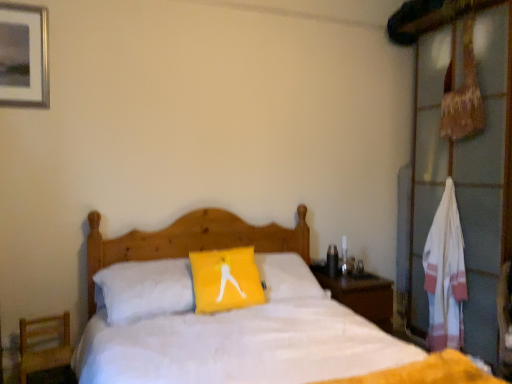
Question: From a real-world perspective, is metallic silver picture frame at upper left on white wood dresser at right?

Choices:
 (A) no
 (B) yes

Answer: (B)

Question: Is metallic silver picture frame at upper left surrounding white wood dresser at right?

Choices:
 (A) no
 (B) yes

Answer: (A)

Question: Is metallic silver picture frame at upper left to the left of white wood dresser at right from the viewer's perspective?

Choices:
 (A) yes
 (B) no

Answer: (A)

Question: Is metallic silver picture frame at upper left at the right side of white wood dresser at right?

Choices:
 (A) no
 (B) yes

Answer: (A)

Question: From the image's perspective, is metallic silver picture frame at upper left under white wood dresser at right?

Choices:
 (A) no
 (B) yes

Answer: (A)

Question: Considering the relative sizes of metallic silver picture frame at upper left and white wood dresser at right in the image provided, is metallic silver picture frame at upper left bigger than white wood dresser at right?

Choices:
 (A) no
 (B) yes

Answer: (A)

Question: Can you confirm if white striped towel at right is bigger than metallic silver picture frame at upper left?

Choices:
 (A) yes
 (B) no

Answer: (A)

Question: Is white striped towel at right located outside metallic silver picture frame at upper left?

Choices:
 (A) yes
 (B) no

Answer: (A)

Question: From a real-world perspective, is white striped towel at right located beneath metallic silver picture frame at upper left?

Choices:
 (A) yes
 (B) no

Answer: (A)

Question: Considering the relative sizes of white striped towel at right and metallic silver picture frame at upper left in the image provided, is white striped towel at right smaller than metallic silver picture frame at upper left?

Choices:
 (A) no
 (B) yes

Answer: (A)

Question: Considering the relative positions of white striped towel at right and metallic silver picture frame at upper left in the image provided, is white striped towel at right to the right of metallic silver picture frame at upper left from the viewer's perspective?

Choices:
 (A) yes
 (B) no

Answer: (A)

Question: Is metallic silver picture frame at upper left surrounded by white striped towel at right?

Choices:
 (A) yes
 (B) no

Answer: (B)

Question: Is wooden nightstand at right far from metallic silver picture frame at upper left?

Choices:
 (A) yes
 (B) no

Answer: (A)